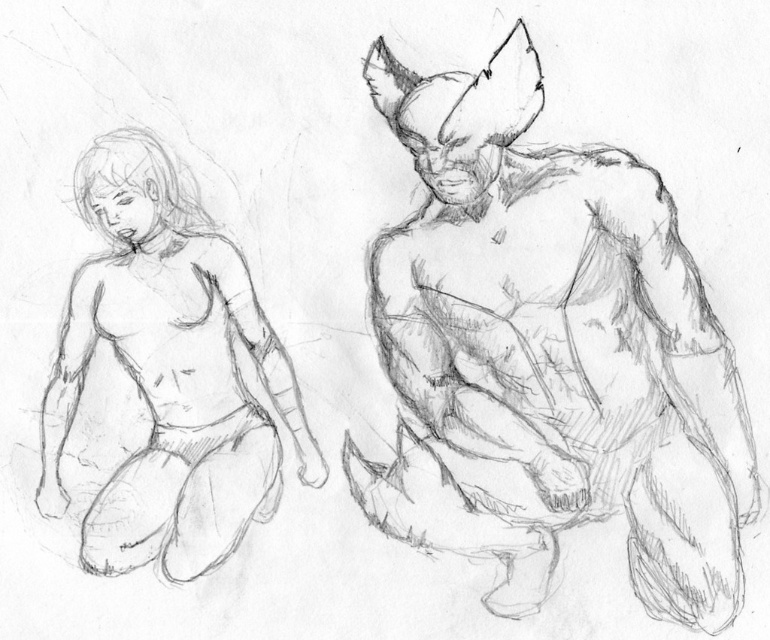
Between point (407, 504) and point (199, 497), which one is positioned in front?

Point (407, 504) is more forward.

Looking at this image, between graphite sketch of muscular figure at right and smooth skin figure at left, which one is positioned higher?

smooth skin figure at left is above.

Identify the location of graphite sketch of muscular figure at right. (548, 355).

In order to click on graphite sketch of muscular figure at right in this screenshot , I will do `click(548, 355)`.